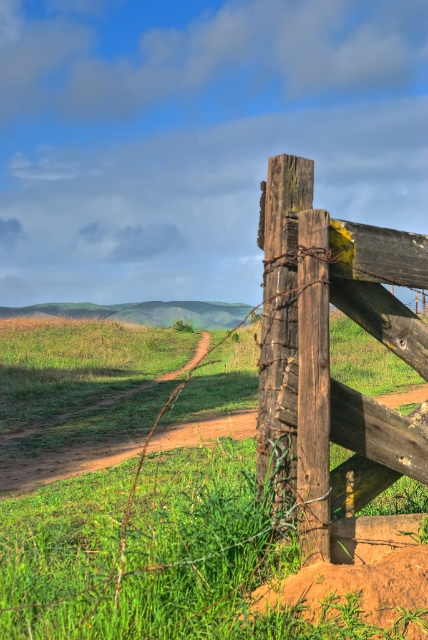
Question: Can you confirm if green grassy at center is positioned to the right of green grassy hill at center?

Choices:
 (A) yes
 (B) no

Answer: (A)

Question: Among these points, which one is nearest to the camera?

Choices:
 (A) (92, 364)
 (B) (272, 436)

Answer: (B)

Question: Can you confirm if green grassy at center is positioned to the left of green grassy hill at center?

Choices:
 (A) no
 (B) yes

Answer: (A)

Question: Which object is closer to the camera taking this photo?

Choices:
 (A) green grassy hill at center
 (B) green grassy at center
 (C) weathered wood fence at right

Answer: (B)

Question: Which object is the farthest from the green grassy at center?

Choices:
 (A) green grassy hill at center
 (B) weathered wood fence at right

Answer: (A)

Question: Can you confirm if weathered wood fence at right is smaller than green grassy hill at center?

Choices:
 (A) yes
 (B) no

Answer: (A)